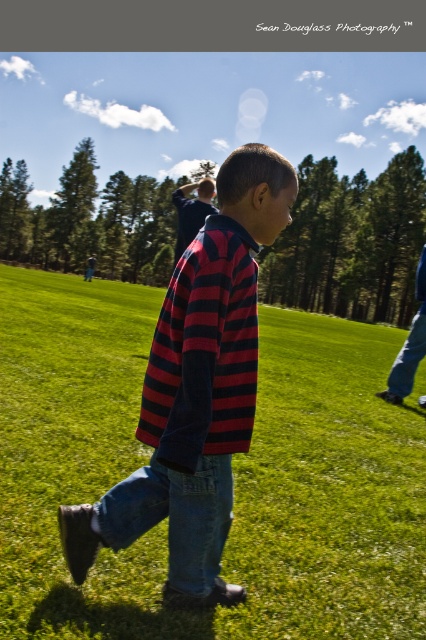
You are a photographer trying to capture a photo of the striped cotton shirt at center and the green grass at center. If you want to ensure both are fully visible in the frame, which object should you focus on to avoid cropping?

You should focus on the green grass at center because it is wider than the striped cotton shirt at center, so ensuring the wider object fits will automatically include the narrower one.

Based on the scene description, can you determine which object is positioned higher in the image between the green grass at center and the striped cotton shirt at center?

The green grass at center is positioned above the striped cotton shirt at center, meaning it is higher in the image.